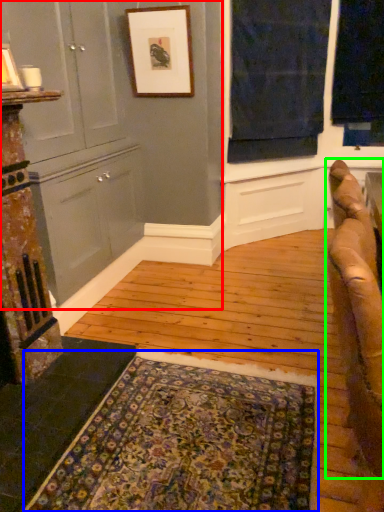
Question: Which object is the closest to the dresser (highlighted by a red box)? Choose among these: mat (highlighted by a blue box) or studio couch (highlighted by a green box).

Choices:
 (A) mat
 (B) studio couch

Answer: (A)